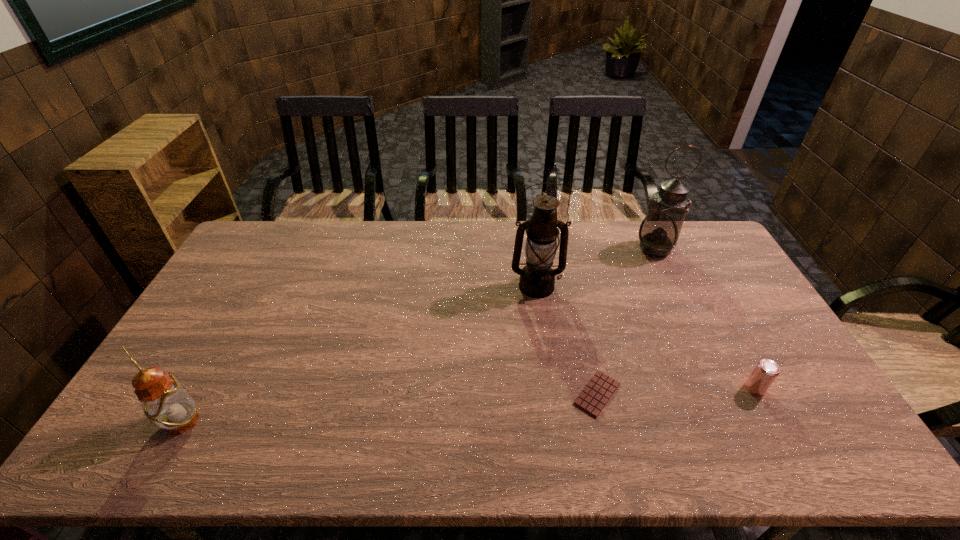
You are a GUI agent. You are given a task and a screenshot of the screen. Output one action in this format:
    pyautogui.click(x=<x>, y=<y>)
    Task: Click on the rightmost oil lamp
    This screenshot has width=960, height=540.
    Given the screenshot: What is the action you would take?
    pyautogui.click(x=659, y=231)

Find the location of a particular element. The height and width of the screenshot is (540, 960). the farthest oil lamp is located at coordinates (659, 231).

The width and height of the screenshot is (960, 540). Find the location of `the second farthest oil lamp`. the second farthest oil lamp is located at coordinates (537, 279).

Find the location of a particular element. The image size is (960, 540). the fourth nearest object is located at coordinates (537, 279).

Where is `the third tallest object`? The width and height of the screenshot is (960, 540). the third tallest object is located at coordinates (164, 400).

Locate an element on the screen. the leftmost oil lamp is located at coordinates (164, 400).

What are the coordinates of `the second shortest object` in the screenshot? It's located at (766, 371).

The image size is (960, 540). I want to click on candy bar, so click(x=594, y=397).

Identify the location of blank space located 0.280m on the left of the rightmost oil lamp. (559, 249).

You are a GUI agent. You are given a task and a screenshot of the screen. Output one action in this format:
    pyautogui.click(x=<x>, y=<y>)
    Task: Click on the free spot located on the front of the second farthest object
    Image resolution: width=960 pixels, height=540 pixels.
    Given the screenshot: What is the action you would take?
    pyautogui.click(x=553, y=407)